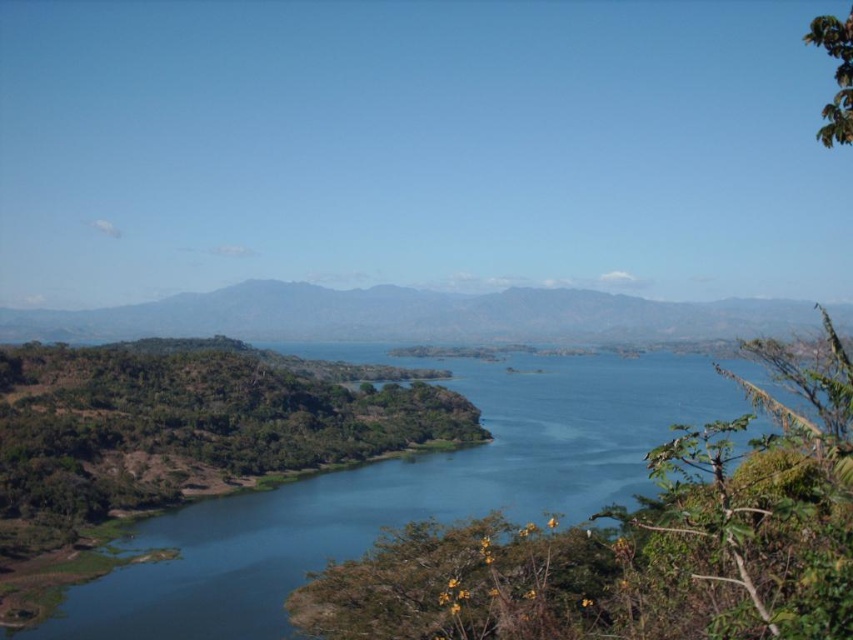
Which of these two, blue water at center or green matte mountain at center, stands shorter?

With less height is blue water at center.

Does blue water at center have a greater height compared to green matte mountain at center?

No, blue water at center is not taller than green matte mountain at center.

Image resolution: width=853 pixels, height=640 pixels. Find the location of `blue water at center`. blue water at center is located at coordinates (401, 497).

I want to click on blue water at center, so click(x=401, y=497).